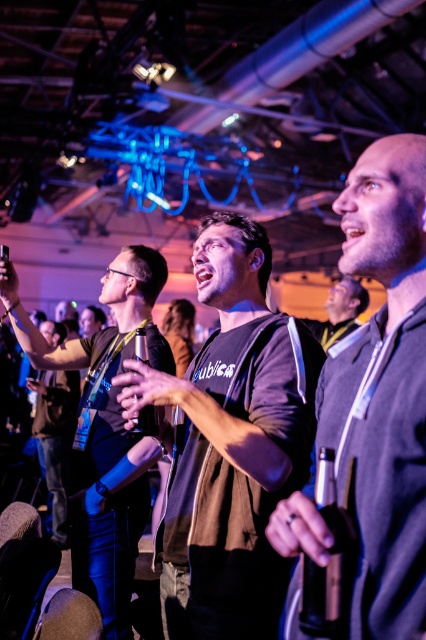
Question: Which point is farther to the camera?

Choices:
 (A) (103, 340)
 (B) (386, 481)

Answer: (A)

Question: Is dark gray fleece at center below black fabric shirt at center?

Choices:
 (A) no
 (B) yes

Answer: (A)

Question: Which of the following is the closest to the observer?

Choices:
 (A) (74, 520)
 (B) (308, 324)
 (C) (60, 330)
 (D) (278, 438)

Answer: (D)

Question: Which point appears closest to the camera in this image?

Choices:
 (A) (66, 508)
 (B) (88, 358)
 (C) (233, 348)
 (D) (328, 300)

Answer: (C)

Question: Can you confirm if dark gray t-shirt at center is wider than black fabric shirt at center?

Choices:
 (A) yes
 (B) no

Answer: (A)

Question: Can you confirm if dark gray fleece at center is positioned to the right of matte black shirt at left?

Choices:
 (A) yes
 (B) no

Answer: (A)